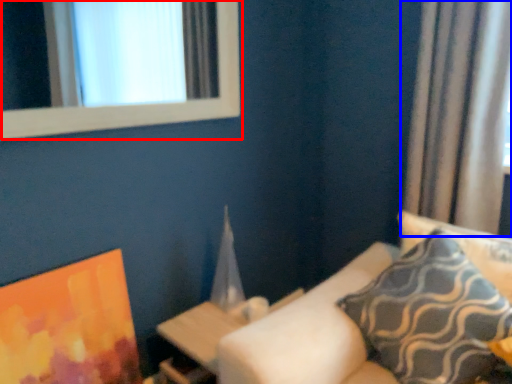
Question: Which object is closer to the camera taking this photo, window (highlighted by a red box) or curtain (highlighted by a blue box)?

Choices:
 (A) window
 (B) curtain

Answer: (A)